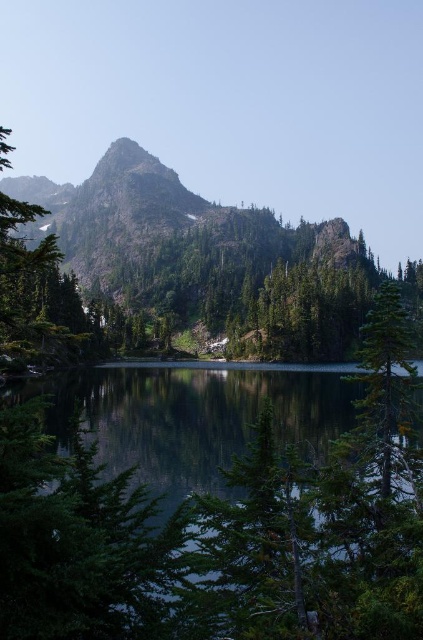
Is green reflective water at center taller than green matte tree at right?

Correct, green reflective water at center is much taller as green matte tree at right.

Between green reflective water at center and green matte tree at right, which one has more height?

green reflective water at center is taller.

Who is more distant from viewer, [393,506] or [415,374]?

Point [415,374]

At what (x,y) coordinates should I click in order to perform the action: click on green reflective water at center. Please return your answer as a coordinate pair (x, y). The width and height of the screenshot is (423, 640). Looking at the image, I should click on (197, 547).